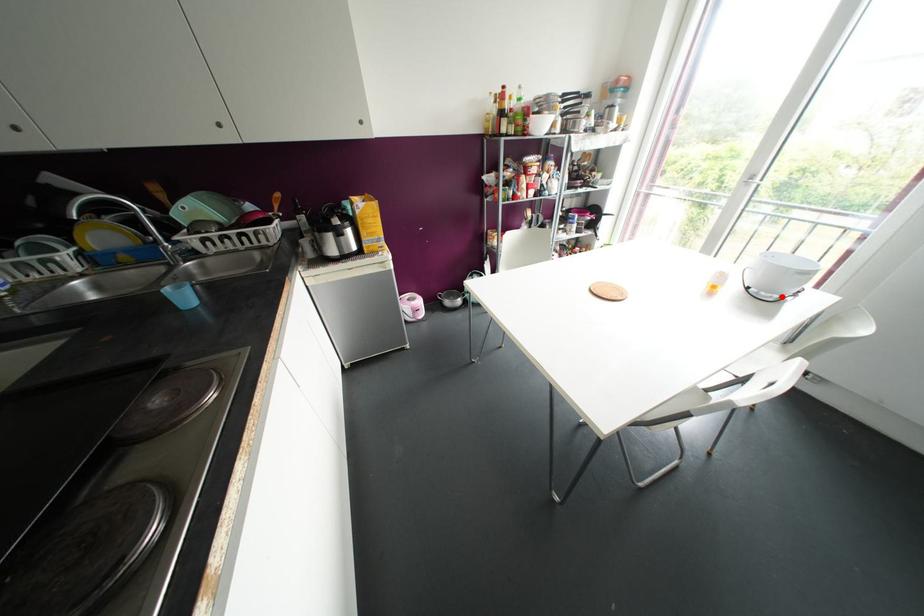
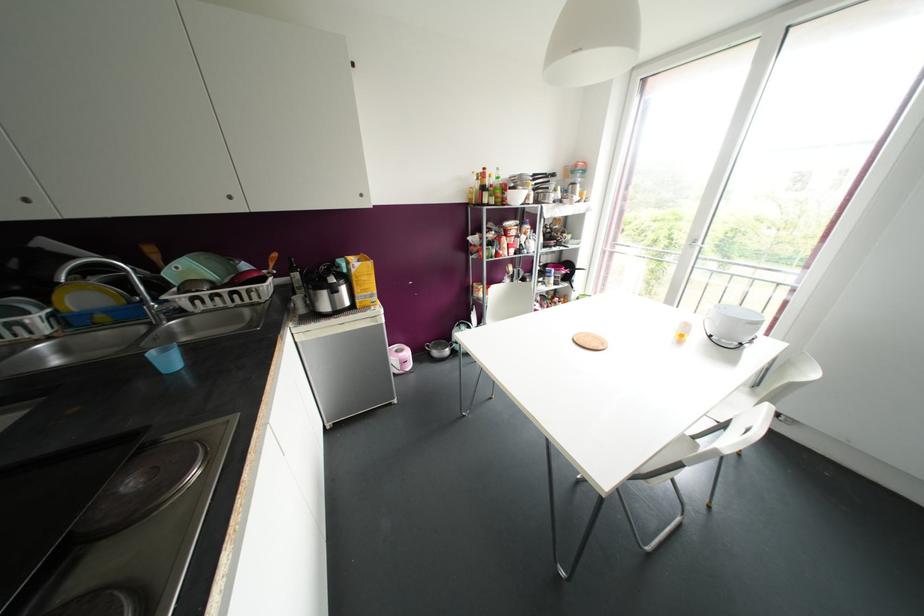
Find the pixel in the second image that matches the highlighted location in the first image.

(740, 342)